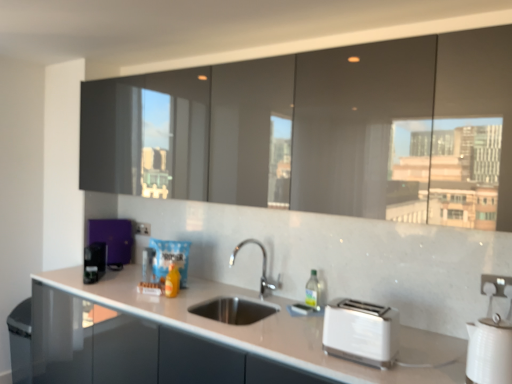
This screenshot has width=512, height=384. Describe the element at coordinates (113, 238) in the screenshot. I see `purple matte coffee maker at left, which is the fourth appliance in right-to-left order` at that location.

This screenshot has width=512, height=384. Describe the element at coordinates (495, 283) in the screenshot. I see `white plastic electric outlet at lower right, acting as the second electric outlet starting from the top` at that location.

Based on the photo, what is the approximate height of white glossy electric kettle at lower right, the 1th appliance when ordered from right to left?

white glossy electric kettle at lower right, the 1th appliance when ordered from right to left, is 30.72 centimeters tall.

What do you see at coordinates (148, 264) in the screenshot?
I see `metallic silver toaster at center, placed as the 3th appliance when sorted from left to right` at bounding box center [148, 264].

Where is `black plastic coffee machine at left, which ranks as the 2th appliance in front-to-back order`? This screenshot has width=512, height=384. black plastic coffee machine at left, which ranks as the 2th appliance in front-to-back order is located at coordinates (94, 262).

How much distance is there between white plastic toaster at lower right and black plastic coffee machine at left, the third appliance viewed from the right?

They are 5.11 feet apart.

Considering the relative sizes of white plastic toaster at lower right and black plastic coffee machine at left, arranged as the 3th appliance when viewed from the back, in the image provided, is white plastic toaster at lower right shorter than black plastic coffee machine at left, arranged as the 3th appliance when viewed from the back,?

Correct, white plastic toaster at lower right is not as tall as black plastic coffee machine at left, arranged as the 3th appliance when viewed from the back.

How many degrees apart are the facing directions of white plastic toaster at lower right and black plastic coffee machine at left, arranged as the 3th appliance when viewed from the back?

The angular difference between white plastic toaster at lower right and black plastic coffee machine at left, arranged as the 3th appliance when viewed from the back, is 40.9 degrees.

Which is more to the right, white plastic toaster at lower right or black plastic coffee machine at left, the third appliance viewed from the right?

Positioned to the right is white plastic toaster at lower right.

Where is `the 2nd appliance behind when counting from the glossy dark gray cabinets at upper center`? The height and width of the screenshot is (384, 512). the 2nd appliance behind when counting from the glossy dark gray cabinets at upper center is located at coordinates 148,264.

In the scene shown: Choose the correct answer: Is glossy dark gray cabinets at upper center inside metallic silver toaster at center, which is the third appliance from front to back, or outside it?

glossy dark gray cabinets at upper center cannot be found inside metallic silver toaster at center, which is the third appliance from front to back.

Which object is more forward, glossy dark gray cabinets at upper center or metallic silver toaster at center, placed as the 2th appliance when sorted from right to left?

Positioned in front is glossy dark gray cabinets at upper center.

Is glossy dark gray cabinets at upper center taller or shorter than metallic silver toaster at center, which is the third appliance from front to back?

Clearly, glossy dark gray cabinets at upper center is taller compared to metallic silver toaster at center, which is the third appliance from front to back.

Between glossy dark gray cabinets at upper center and white plastic electric outlet at center, the second electric outlet from the right, which one has larger width?

Wider between the two is glossy dark gray cabinets at upper center.

From the image's perspective, which is below, glossy dark gray cabinets at upper center or white plastic electric outlet at center, which is counted as the 1th electric outlet, starting from the top?

white plastic electric outlet at center, which is counted as the 1th electric outlet, starting from the top, appears lower in the image.

In the scene shown: Does glossy dark gray cabinets at upper center have a greater height compared to white plastic electric outlet at center, which is counted as the 1th electric outlet, starting from the top?

Yes.

Relative to white plastic electric outlet at center, the second electric outlet from the right, is glossy dark gray cabinets at upper center in front or behind?

glossy dark gray cabinets at upper center is in front of white plastic electric outlet at center, the second electric outlet from the right.

Between white plastic electric outlet at lower right, acting as the second electric outlet starting from the top, and white plastic toaster at lower right, which one is positioned in front?

white plastic toaster at lower right.

Is white plastic electric outlet at lower right, positioned as the 1th electric outlet in right-to-left order, oriented towards white plastic toaster at lower right?

No, white plastic electric outlet at lower right, positioned as the 1th electric outlet in right-to-left order, is not turned towards white plastic toaster at lower right.

Starting from the white plastic toaster at lower right, which electric outlet is the 1st one behind? Please provide its 2D coordinates.

[(495, 283)]

Considering the positions of objects white plastic electric outlet at lower right, positioned as the 1th electric outlet in right-to-left order, and white plastic toaster at lower right in the image provided, who is more to the left, white plastic electric outlet at lower right, positioned as the 1th electric outlet in right-to-left order, or white plastic toaster at lower right?

Positioned to the left is white plastic toaster at lower right.

In the scene shown: From the image's perspective, is white glossy countertop at center over glossy dark gray cabinets at upper center?

Incorrect, from the image's perspective, white glossy countertop at center is lower than glossy dark gray cabinets at upper center.

Is white glossy countertop at center closer to the viewer compared to glossy dark gray cabinets at upper center?

Yes, white glossy countertop at center is closer to the camera.

Could glossy dark gray cabinets at upper center be considered to be inside white glossy countertop at center?

No, glossy dark gray cabinets at upper center is not surrounded by white glossy countertop at center.

Which object is thinner, white plastic electric outlet at center, the second electric outlet from the right, or metallic silver toaster at center, which is the third appliance from front to back?

With smaller width is white plastic electric outlet at center, the second electric outlet from the right.

Considering the sizes of white plastic electric outlet at center, the first electric outlet viewed from the back, and metallic silver toaster at center, arranged as the second appliance when viewed from the back, in the image, is white plastic electric outlet at center, the first electric outlet viewed from the back, taller or shorter than metallic silver toaster at center, arranged as the second appliance when viewed from the back,?

white plastic electric outlet at center, the first electric outlet viewed from the back, is shorter than metallic silver toaster at center, arranged as the second appliance when viewed from the back.

Is point (145, 223) in front of point (145, 252)?

That is False.

Does white plastic toaster at lower right have a larger size compared to white plastic electric outlet at lower right, placed as the first electric outlet when sorted from bottom to top?

Yes.

Is white plastic toaster at lower right oriented towards white plastic electric outlet at lower right, placed as the first electric outlet when sorted from bottom to top?

No, white plastic toaster at lower right is not oriented towards white plastic electric outlet at lower right, placed as the first electric outlet when sorted from bottom to top.

Which of these two, white plastic toaster at lower right or white plastic electric outlet at lower right, which is the 1th electric outlet in front-to-back order, stands taller?

With more height is white plastic toaster at lower right.

This screenshot has height=384, width=512. What are the coordinates of `toaster that appears below the black plastic coffee machine at left, which ranks as the 2th appliance in front-to-back order (from the image's perspective)` in the screenshot? It's located at (361, 332).

Locate an element on the screen. The width and height of the screenshot is (512, 384). cabinetry in front of the metallic silver toaster at center, placed as the 2th appliance when sorted from right to left is located at coordinates (321, 131).

Looking at the image, which one is located closer to black plastic coffee machine at left, which ranks as the 2th appliance in front-to-back order, metallic silver toaster at center, placed as the 2th appliance when sorted from right to left, or translucent plastic bag at center?

The object closer to black plastic coffee machine at left, which ranks as the 2th appliance in front-to-back order, is metallic silver toaster at center, placed as the 2th appliance when sorted from right to left.

Looking at the image, which one is located further to white plastic electric outlet at lower right, the 2th electric outlet in the back-to-front sequence, translucent plastic bag at center or white plastic toaster at lower right?

translucent plastic bag at center lies further to white plastic electric outlet at lower right, the 2th electric outlet in the back-to-front sequence, than the other object.

When comparing their distances from white plastic electric outlet at center, the second electric outlet from the right, does metallic silver toaster at center, arranged as the second appliance when viewed from the back, or white plastic electric outlet at lower right, the 2th electric outlet in the back-to-front sequence, seem further?

white plastic electric outlet at lower right, the 2th electric outlet in the back-to-front sequence, lies further to white plastic electric outlet at center, the second electric outlet from the right, than the other object.

Considering their positions, is purple matte coffee maker at left, arranged as the first appliance when viewed from the back, positioned closer to glossy dark gray cabinets at upper center than metallic silver toaster at center, which is the third appliance from front to back?

metallic silver toaster at center, which is the third appliance from front to back.

Which object lies nearer to the anchor point white glossy electric kettle at lower right, the fourth appliance in the left-to-right sequence, white plastic electric outlet at center, the 2th electric outlet from the front, or purple matte coffee maker at left, which is the fourth appliance in right-to-left order?

white plastic electric outlet at center, the 2th electric outlet from the front, is closer to white glossy electric kettle at lower right, the fourth appliance in the left-to-right sequence.

Considering their positions, is purple matte coffee maker at left, arranged as the first appliance when viewed from the back, positioned further to metallic silver toaster at center, arranged as the second appliance when viewed from the back, than white glossy electric kettle at lower right, positioned as the fourth appliance in back-to-front order?

white glossy electric kettle at lower right, positioned as the fourth appliance in back-to-front order.

Which object lies nearer to the anchor point black plastic coffee machine at left, the second appliance from the left, translucent plastic bag at center or purple matte coffee maker at left, which is the fourth appliance in right-to-left order?

purple matte coffee maker at left, which is the fourth appliance in right-to-left order, is positioned closer to the anchor black plastic coffee machine at left, the second appliance from the left.

Estimate the real-world distances between objects in this image. Which object is closer to glossy dark gray cabinets at upper center, white plastic electric outlet at center, acting as the 1th electric outlet starting from the left, or white plastic electric outlet at lower right, acting as the second electric outlet starting from the top?

white plastic electric outlet at lower right, acting as the second electric outlet starting from the top, lies closer to glossy dark gray cabinets at upper center than the other object.

I want to click on orange juice between glossy dark gray cabinets at upper center and white glossy countertop at center vertically, so click(x=172, y=281).

Locate an element on the screen. This screenshot has width=512, height=384. orange juice between black plastic coffee machine at left, arranged as the 3th appliance when viewed from the back, and white glossy electric kettle at lower right, positioned as the fourth appliance in back-to-front order, from left to right is located at coordinates [x=172, y=281].

This screenshot has height=384, width=512. Identify the location of toaster between translucent plastic bag at center and white plastic electric outlet at lower right, which is the 2th electric outlet in left-to-right order, in the horizontal direction. (361, 332).

At what (x,y) coordinates should I click in order to perform the action: click on cabinetry between white glossy countertop at center and black plastic coffee machine at left, the second appliance from the left, in the front-back direction. Please return your answer as a coordinate pair (x, y). The width and height of the screenshot is (512, 384). Looking at the image, I should click on pos(321,131).